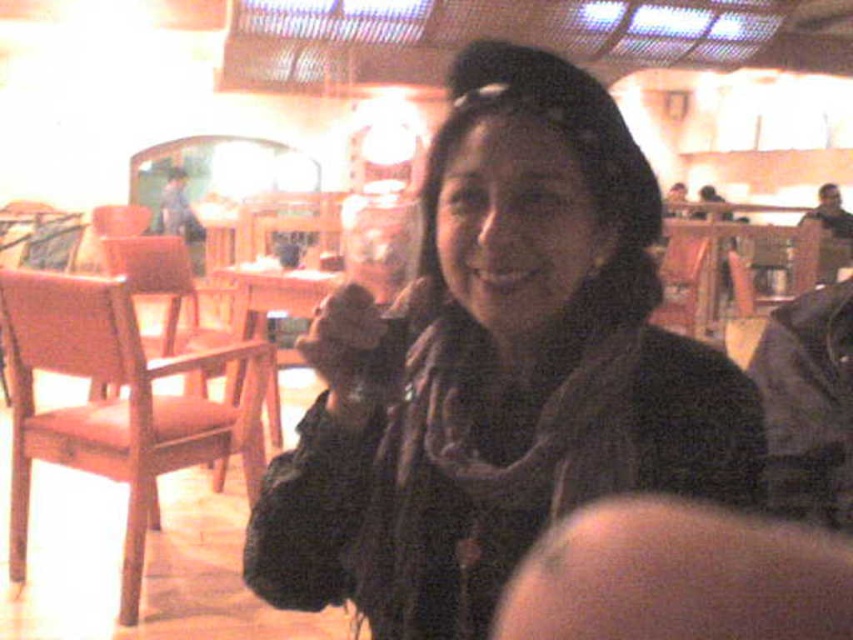
Does black matte scarf at center have a smaller size compared to wooden table at center?

Yes.

Who is more distant from viewer, (729,456) or (244,321)?

Positioned behind is point (244,321).

Describe the element at coordinates (503, 371) in the screenshot. I see `black matte scarf at center` at that location.

This screenshot has height=640, width=853. Find the location of `black matte scarf at center`. black matte scarf at center is located at coordinates (503, 371).

Is black matte scarf at center above matte black hand at center?

No, black matte scarf at center is not above matte black hand at center.

Between black matte scarf at center and matte black hand at center, which one has less height?

matte black hand at center

Between point (345, 593) and point (341, 353), which one is positioned behind?

Point (345, 593)

Where is `black matte scarf at center`? The width and height of the screenshot is (853, 640). black matte scarf at center is located at coordinates (503, 371).

Does wooden table at center have a lesser width compared to matte black hand at center?

No, wooden table at center is not thinner than matte black hand at center.

Which is in front, point (274, 269) or point (312, 332)?

Point (312, 332) is in front.

Locate an element on the screen. Image resolution: width=853 pixels, height=640 pixels. wooden table at center is located at coordinates (271, 316).